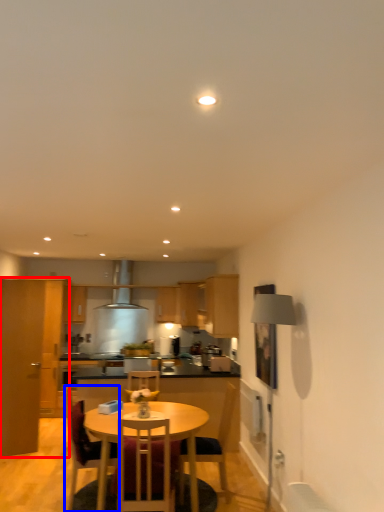
Question: Which object appears farthest to the camera in this image, cabinetry (highlighted by a red box) or chair (highlighted by a blue box)?

Choices:
 (A) cabinetry
 (B) chair

Answer: (A)